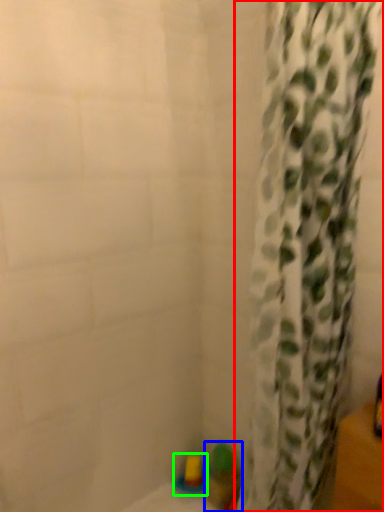
Question: Estimate the real-world distances between objects in this image. Which object is closer to curtain (highlighted by a red box), toy (highlighted by a blue box) or toy (highlighted by a green box)?

Choices:
 (A) toy
 (B) toy

Answer: (A)